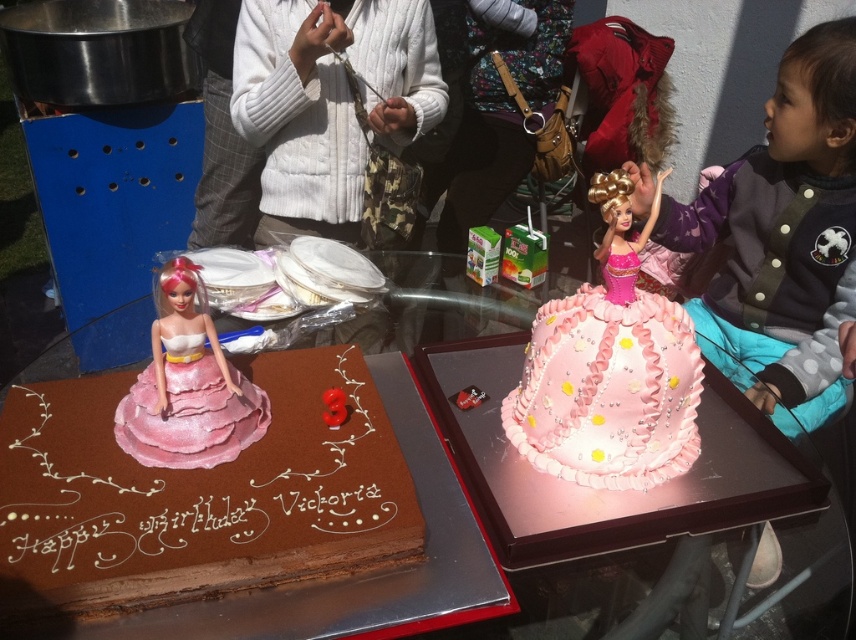
Is light blue denim pants at right taller than white fuzzy sweater at upper center?

Correct, light blue denim pants at right is much taller as white fuzzy sweater at upper center.

Is point (739, 352) behind point (391, 26)?

No, (739, 352) is in front of (391, 26).

Between point (759, 253) and point (278, 35), which one is positioned behind?

The point (278, 35) is more distant.

You are a GUI agent. You are given a task and a screenshot of the screen. Output one action in this format:
    pyautogui.click(x=<x>, y=<y>)
    Task: Click on the light blue denim pants at right
    
    Given the screenshot: What is the action you would take?
    pyautogui.click(x=783, y=241)

Can you confirm if light blue denim pants at right is positioned above matte pink fabric doll at center?

Yes, light blue denim pants at right is above matte pink fabric doll at center.

Who is taller, light blue denim pants at right or matte pink fabric doll at center?

light blue denim pants at right is taller.

Is point (783, 216) more distant than point (230, 451)?

That is True.

This screenshot has width=856, height=640. Find the location of `light blue denim pants at right`. light blue denim pants at right is located at coordinates (783, 241).

Between pink frosted cake at center and matte pink fabric doll at center, which one is positioned lower?

pink frosted cake at center

Does point (605, 445) come farther from viewer compared to point (209, 369)?

Yes, point (605, 445) is behind point (209, 369).

Find the location of `pink frosted cake at center`. pink frosted cake at center is located at coordinates (607, 392).